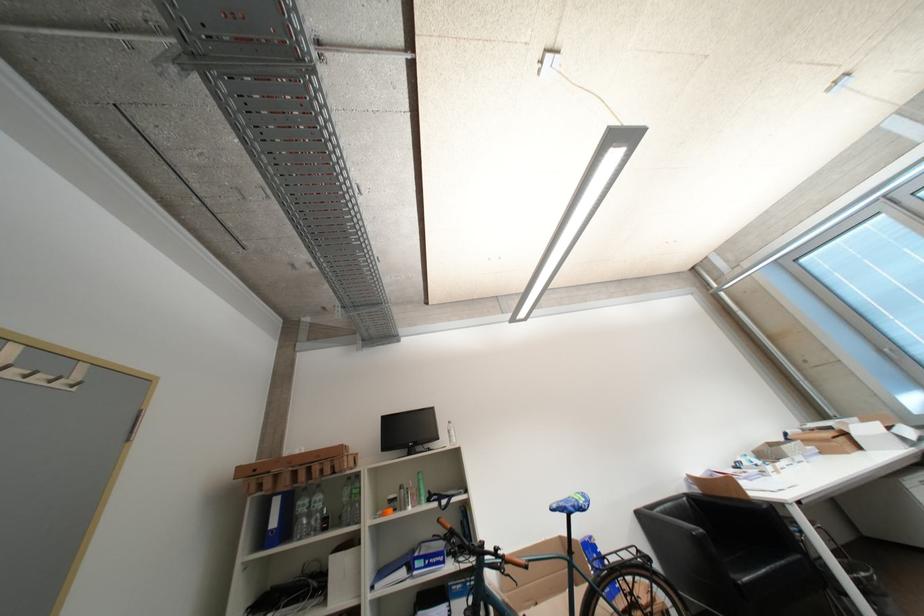
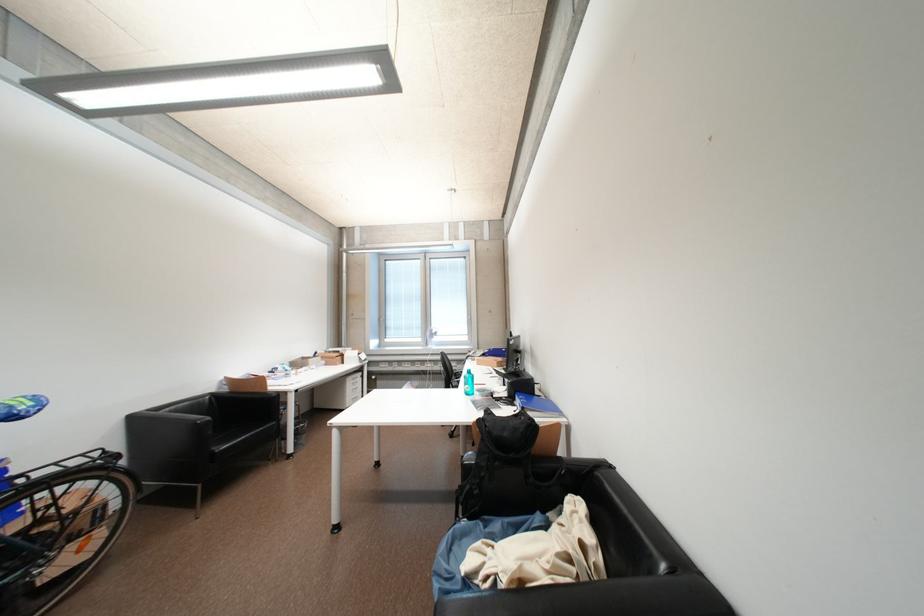
Where in the second image is the point corresponding to point (648, 517) from the first image?

(141, 421)